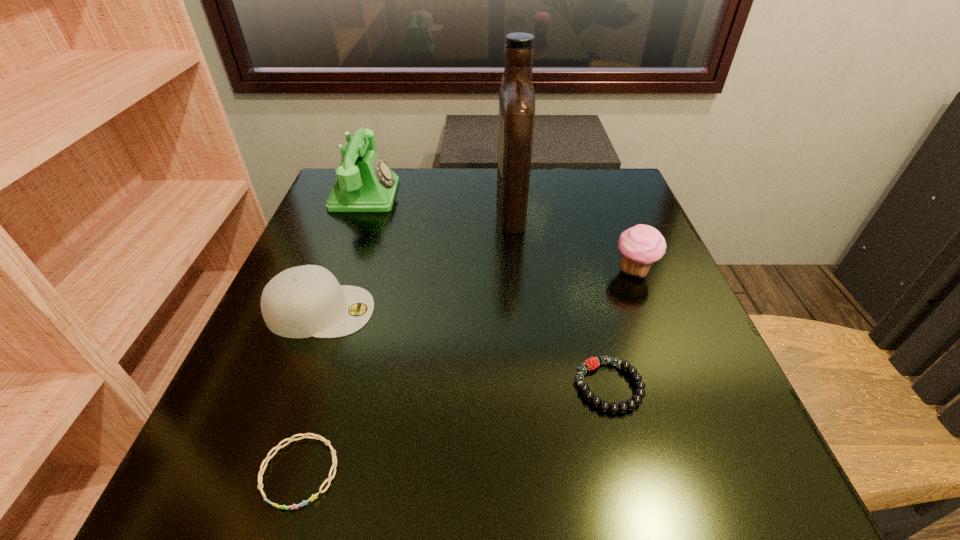
You are a GUI agent. You are given a task and a screenshot of the screen. Output one action in this format:
    pyautogui.click(x=<x>, y=<y>)
    Task: Click on the nearer bracelet
    The height and width of the screenshot is (540, 960).
    Given the screenshot: What is the action you would take?
    pyautogui.click(x=260, y=475)

You are a GUI agent. You are given a task and a screenshot of the screen. Output one action in this format:
    pyautogui.click(x=<x>, y=<y>)
    Task: Click on the vacant position located 0.140m on the label side of the fourth object from left to right
    The width and height of the screenshot is (960, 540).
    Given the screenshot: What is the action you would take?
    pyautogui.click(x=439, y=206)

At what (x,y) coordinates should I click in order to perform the action: click on free location located on the label side of the fourth object from left to right. Please return your answer as a coordinate pair (x, y). This screenshot has width=960, height=540. Looking at the image, I should click on (372, 206).

Find the location of a particular element. Image resolution: width=960 pixels, height=540 pixels. vacant space located 0.370m on the label side of the fourth object from left to right is located at coordinates (344, 206).

This screenshot has width=960, height=540. Find the location of `free space located 0.140m on the dial of the telephone`. free space located 0.140m on the dial of the telephone is located at coordinates (452, 194).

The height and width of the screenshot is (540, 960). In order to click on free space located 0.110m on the back of the third farthest object in this screenshot , I will do `click(616, 226)`.

Locate an element on the screen. vacant space located on the front-facing side of the third nearest object is located at coordinates (537, 311).

Find the location of `free space located 0.180m on the left of the second object from right to left`. free space located 0.180m on the left of the second object from right to left is located at coordinates (459, 386).

You are a GUI agent. You are given a task and a screenshot of the screen. Output one action in this format:
    pyautogui.click(x=<x>, y=<y>)
    Task: Click on the liquor that is at the far edge
    The width and height of the screenshot is (960, 540).
    Given the screenshot: What is the action you would take?
    pyautogui.click(x=516, y=97)

Find the location of a particular element. This screenshot has height=540, width=960. telephone at the far edge is located at coordinates (364, 183).